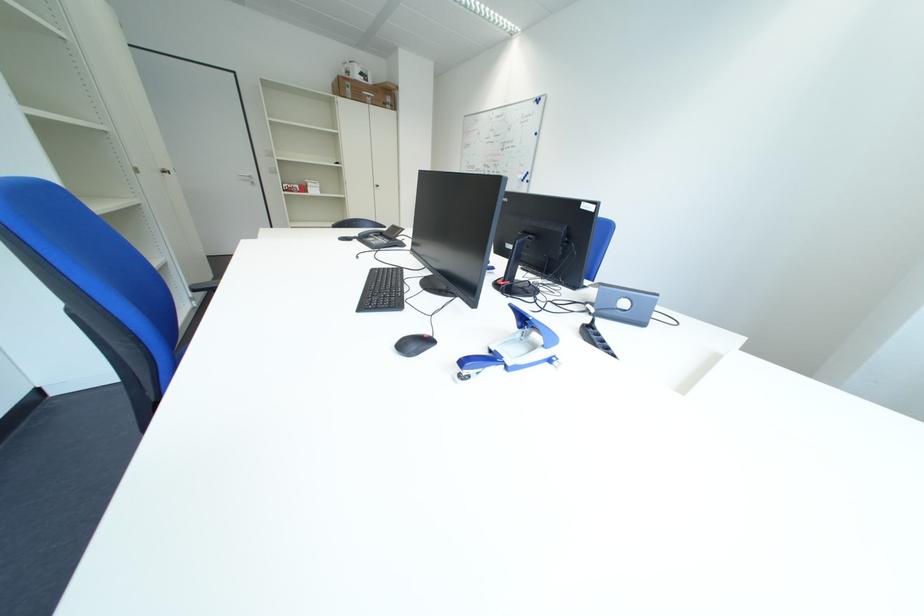
Where would you lift the telephone handset? Please return your answer as a coordinate pair (x, y).

(371, 235)